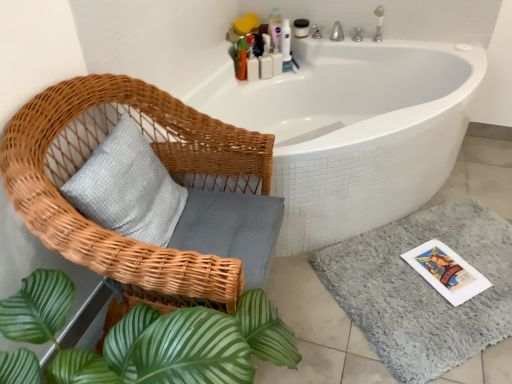
Question: From the image's perspective, is matte white jar at upper center, which ranks as the first toiletry in right-to-left order, on top of translucent plastic bottles at upper right, the 1th toiletry when ordered from left to right?

Choices:
 (A) yes
 (B) no

Answer: (A)

Question: Is matte white jar at upper center, which ranks as the first toiletry in right-to-left order, bigger than translucent plastic bottles at upper right, the fifth toiletry positioned from the right?

Choices:
 (A) no
 (B) yes

Answer: (A)

Question: From the image's perspective, is matte white jar at upper center, which ranks as the first toiletry in right-to-left order, under translucent plastic bottles at upper right, the fifth toiletry positioned from the right?

Choices:
 (A) yes
 (B) no

Answer: (B)

Question: Are matte white jar at upper center, which is counted as the 5th toiletry, starting from the left, and translucent plastic bottles at upper right, the fifth toiletry positioned from the right, far apart?

Choices:
 (A) yes
 (B) no

Answer: (B)

Question: Does matte white jar at upper center, which is counted as the 5th toiletry, starting from the left, have a smaller size compared to translucent plastic bottles at upper right, the fifth toiletry positioned from the right?

Choices:
 (A) no
 (B) yes

Answer: (B)

Question: Looking at the image, does gray shaggy bath mat at lower right seem bigger or smaller compared to white plastic bottles at upper center, arranged as the fourth toiletry when viewed from the left?

Choices:
 (A) big
 (B) small

Answer: (A)

Question: From the image's perspective, is gray shaggy bath mat at lower right located above or below white plastic bottles at upper center, positioned as the second toiletry in right-to-left order?

Choices:
 (A) below
 (B) above

Answer: (A)

Question: Is point (451, 312) positioned closer to the camera than point (279, 74)?

Choices:
 (A) farther
 (B) closer

Answer: (B)

Question: Visually, is gray shaggy bath mat at lower right positioned to the left or to the right of white plastic bottles at upper center, positioned as the second toiletry in right-to-left order?

Choices:
 (A) left
 (B) right

Answer: (B)

Question: Considering the positions of point (271, 16) and point (337, 249), is point (271, 16) closer or farther from the camera than point (337, 249)?

Choices:
 (A) farther
 (B) closer

Answer: (A)

Question: In the image, is pink plastic bottle at upper center, acting as the third toiletry starting from the right, on the left side or the right side of gray shaggy bath mat at lower right?

Choices:
 (A) left
 (B) right

Answer: (A)

Question: Considering their positions, is pink plastic bottle at upper center, acting as the third toiletry starting from the right, located in front of or behind gray shaggy bath mat at lower right?

Choices:
 (A) front
 (B) behind

Answer: (B)

Question: Is pink plastic bottle at upper center, the third toiletry from the left, spatially inside gray shaggy bath mat at lower right, or outside of it?

Choices:
 (A) inside
 (B) outside

Answer: (B)

Question: Considering the positions of point (356, 311) and point (261, 66), is point (356, 311) closer or farther from the camera than point (261, 66)?

Choices:
 (A) farther
 (B) closer

Answer: (B)

Question: Considering the positions of gray shaggy bath mat at lower right and white plastic bottles at upper center, the second toiletry when ordered from left to right, in the image, is gray shaggy bath mat at lower right wider or thinner than white plastic bottles at upper center, the second toiletry when ordered from left to right,?

Choices:
 (A) thin
 (B) wide

Answer: (B)